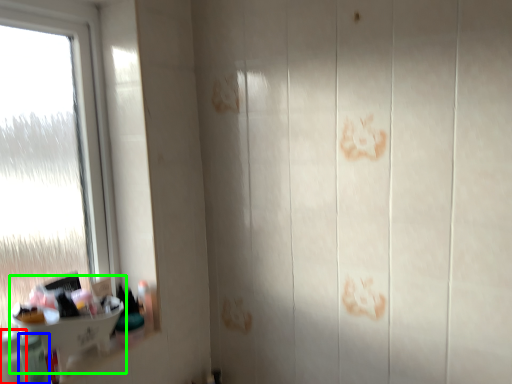
Question: Considering the real-world distances, which object is closest to toiletry (highlighted by a red box)? toiletry (highlighted by a blue box) or sink (highlighted by a green box).

Choices:
 (A) toiletry
 (B) sink

Answer: (A)